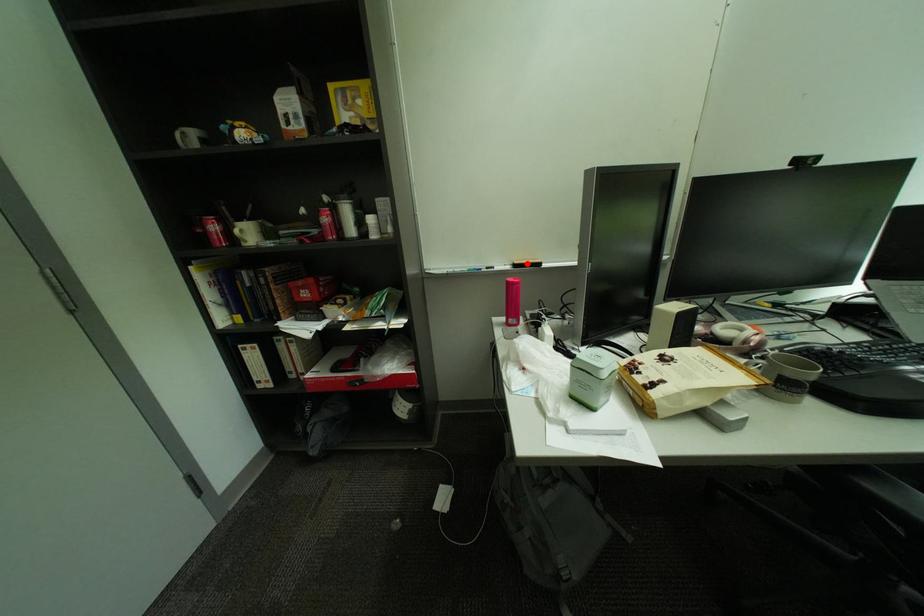
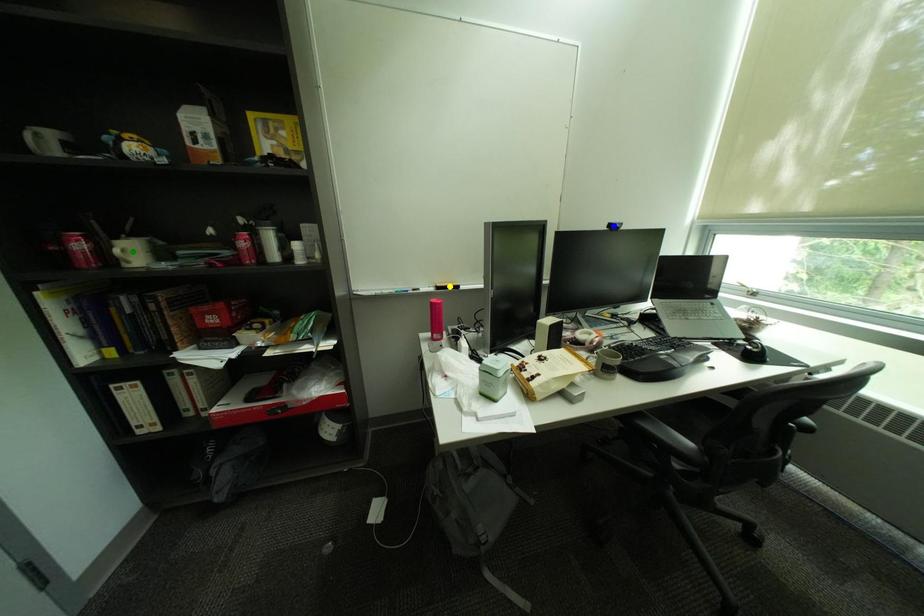
Question: I am providing you with two images of the same scene from different viewpoints. A red point is marked on the first image. You are given multiple points on the second image. Which point in image 2 is actually the same real-world point as the red point in image 1?

Choices:
 (A) green point
 (B) yellow point
 (C) blue point

Answer: (B)